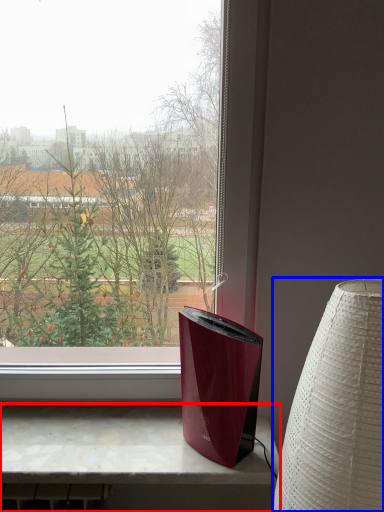
Question: Which object is further to the camera taking this photo, computer desk (highlighted by a red box) or lamp (highlighted by a blue box)?

Choices:
 (A) computer desk
 (B) lamp

Answer: (A)